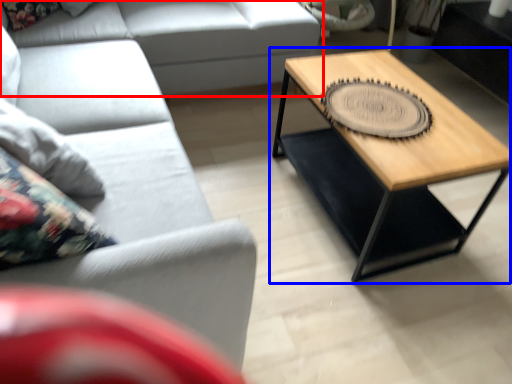
Question: Which of the following is the farthest to the observer, studio couch (highlighted by a red box) or coffee table (highlighted by a blue box)?

Choices:
 (A) studio couch
 (B) coffee table

Answer: (A)